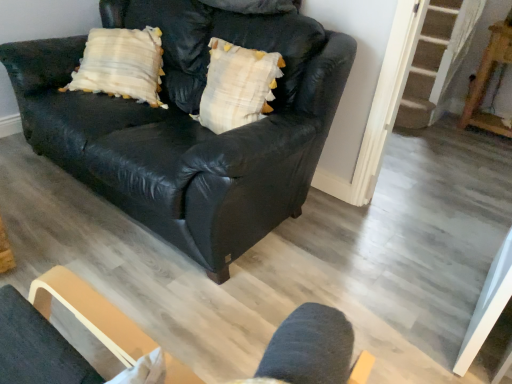
Question: Is white textured pillow at center taller or shorter than wooden table at right?

Choices:
 (A) short
 (B) tall

Answer: (A)

Question: Is white textured pillow at center to the left or to the right of wooden table at right in the image?

Choices:
 (A) left
 (B) right

Answer: (A)

Question: Considering the real-world distances, which object is farthest from the wooden table at right?

Choices:
 (A) white textured pillow at center
 (B) black leather couch at center

Answer: (B)

Question: Which is farther from the white textured pillow at center?

Choices:
 (A) black leather couch at center
 (B) wooden table at right

Answer: (B)